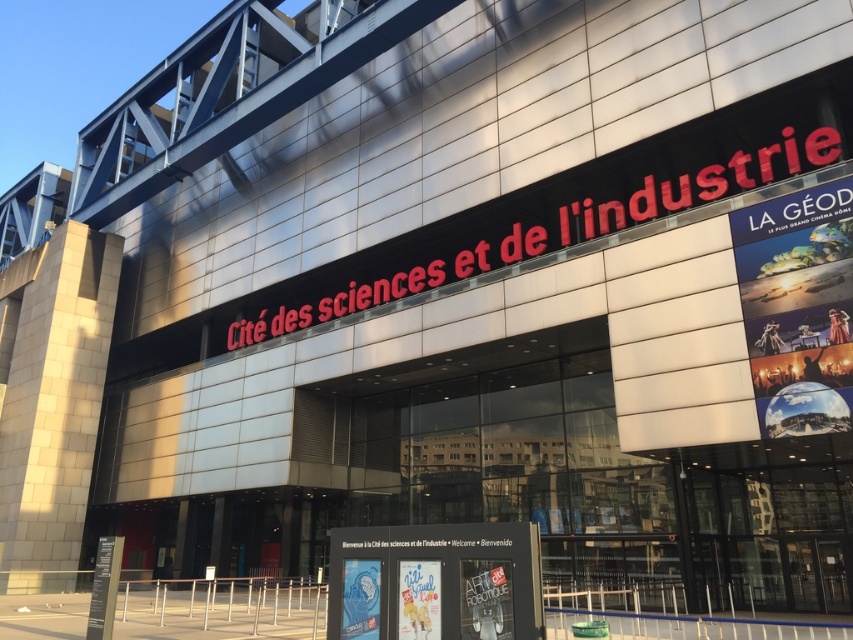
Between metallic poster at right and white plastic sign at center, which one is positioned lower?

white plastic sign at center is lower down.

Can you confirm if metallic poster at right is taller than white plastic sign at center?

Correct, metallic poster at right is much taller as white plastic sign at center.

Is point (827, 388) behind point (489, 582)?

Yes, it is.

You are a GUI agent. You are given a task and a screenshot of the screen. Output one action in this format:
    pyautogui.click(x=<x>, y=<y>)
    Task: Click on the metallic poster at right
    This screenshot has height=640, width=853.
    Given the screenshot: What is the action you would take?
    pyautogui.click(x=798, y=307)